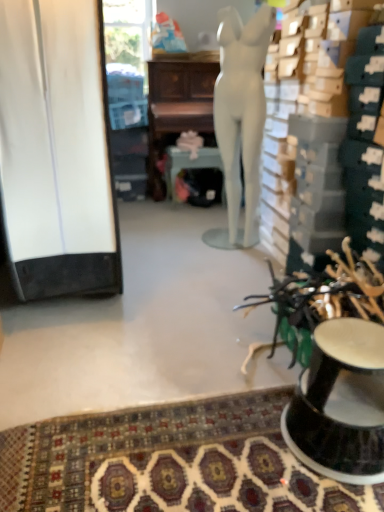
At what (x,y) coordinates should I click in order to perform the action: click on vacant space underneath white matte mannequin at center (from a real-world perspective). Please return your answer as a coordinate pair (x, y). The image size is (384, 512). Looking at the image, I should click on point(232,245).